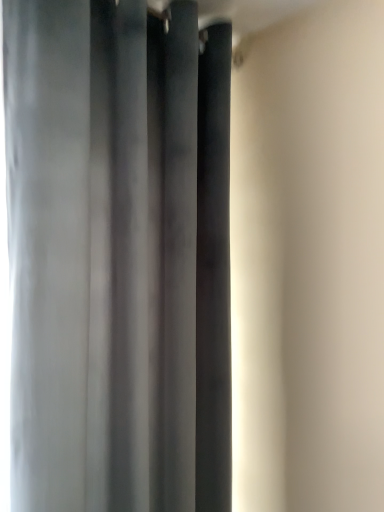
What do you see at coordinates (118, 255) in the screenshot?
I see `matte black curtain at center` at bounding box center [118, 255].

Measure the distance between point (21, 362) and camera.

Point (21, 362) and camera are 77.70 centimeters apart from each other.

Find the location of a particular element. The image size is (384, 512). matte black curtain at center is located at coordinates (118, 255).

What are the coordinates of `matte black curtain at center` in the screenshot? It's located at (118, 255).